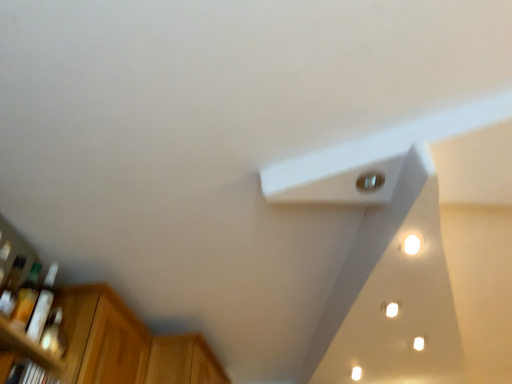
Question: From a real-world perspective, is white matte exhaust hood at upper center located beneath wooden cabinet at lower left?

Choices:
 (A) no
 (B) yes

Answer: (A)

Question: Is white matte exhaust hood at upper center further to the viewer compared to wooden cabinet at lower left?

Choices:
 (A) yes
 (B) no

Answer: (B)

Question: Can you confirm if white matte exhaust hood at upper center is smaller than wooden cabinet at lower left?

Choices:
 (A) no
 (B) yes

Answer: (A)

Question: From a real-world perspective, is white matte exhaust hood at upper center over wooden cabinet at lower left?

Choices:
 (A) yes
 (B) no

Answer: (A)

Question: From the image's perspective, is white matte exhaust hood at upper center over wooden cabinet at lower left?

Choices:
 (A) yes
 (B) no

Answer: (A)

Question: Is white matte exhaust hood at upper center beside wooden cabinet at lower left?

Choices:
 (A) yes
 (B) no

Answer: (B)

Question: From a real-world perspective, is white matte exhaust hood at upper center beneath white glossy light at upper right, which is counted as the first light, starting from the back?

Choices:
 (A) yes
 (B) no

Answer: (B)

Question: Can you confirm if white matte exhaust hood at upper center is shorter than white glossy light at upper right, the 2th light positioned from the front?

Choices:
 (A) yes
 (B) no

Answer: (B)

Question: Is white matte exhaust hood at upper center positioned in front of white glossy light at upper right, arranged as the 1th light when viewed from the right?

Choices:
 (A) yes
 (B) no

Answer: (A)

Question: Is white matte exhaust hood at upper center touching white glossy light at upper right, arranged as the 1th light when viewed from the right?

Choices:
 (A) yes
 (B) no

Answer: (B)

Question: Can you confirm if white matte exhaust hood at upper center is taller than white glossy light at upper right, arranged as the 1th light when viewed from the right?

Choices:
 (A) yes
 (B) no

Answer: (A)

Question: From the image's perspective, is white matte exhaust hood at upper center under white glossy light at upper right, which is the second light from top to bottom?

Choices:
 (A) no
 (B) yes

Answer: (B)

Question: Is wooden cabinet at lower left next to translucent glass bottle at lower left, which is the 2th bottle from back to front?

Choices:
 (A) yes
 (B) no

Answer: (B)